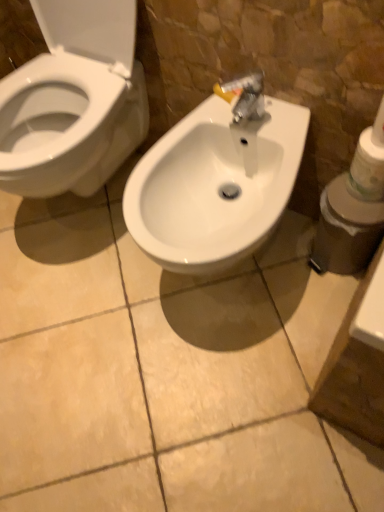
At what (x,y) coordinates should I click in order to perform the action: click on vacant space underneath white glossy sink at center (from a real-world perspective). Please return your answer as a coordinate pair (x, y). The height and width of the screenshot is (512, 384). Looking at the image, I should click on (223, 281).